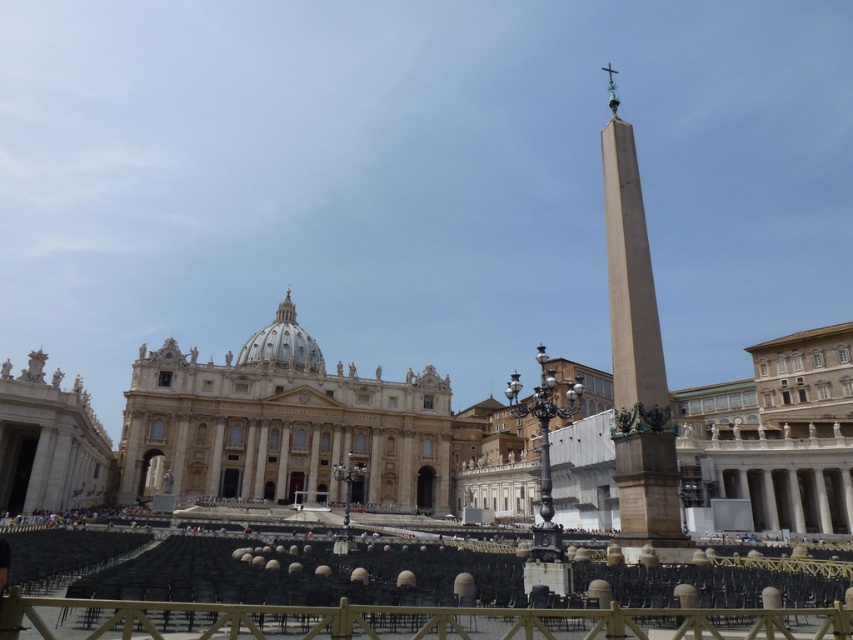
This screenshot has width=853, height=640. Describe the element at coordinates (282, 426) in the screenshot. I see `white marble palace at center` at that location.

Which is below, white marble palace at center or wooden at center?

wooden at center is lower down.

The width and height of the screenshot is (853, 640). What are the coordinates of `white marble palace at center` in the screenshot? It's located at (282, 426).

This screenshot has height=640, width=853. I want to click on white marble palace at center, so click(x=282, y=426).

Measure the distance between white marble palace at center and brown stone obelisk at right.

76.29 meters

Is point (305, 404) positioned in front of point (647, 444)?

That is False.

Find the location of `white marble palace at center`. white marble palace at center is located at coordinates (282, 426).

Is wooden at center shorter than brown stone obelisk at right?

Yes.

Which is above, wooden at center or brown stone obelisk at right?

brown stone obelisk at right is higher up.

Where is `wooden at center`? This screenshot has width=853, height=640. wooden at center is located at coordinates (402, 620).